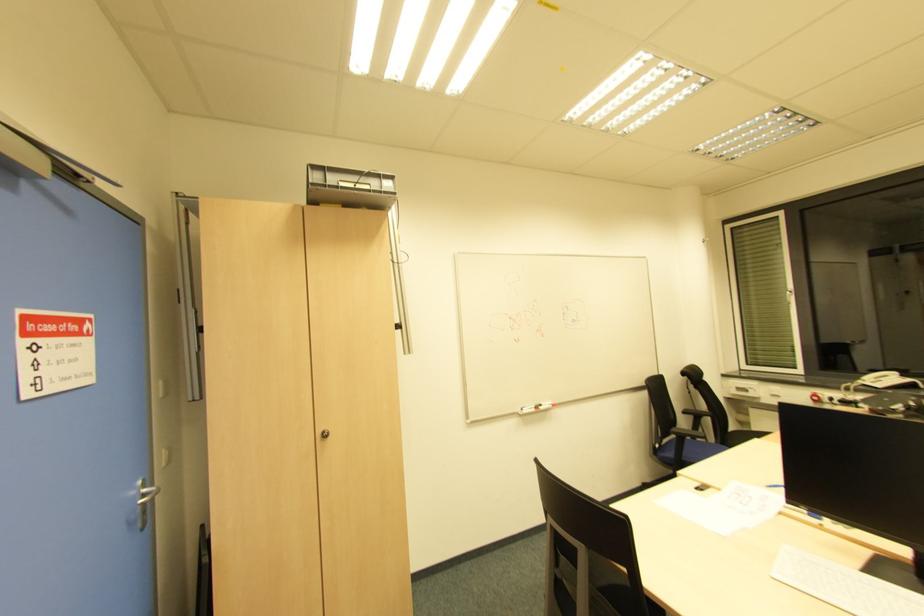
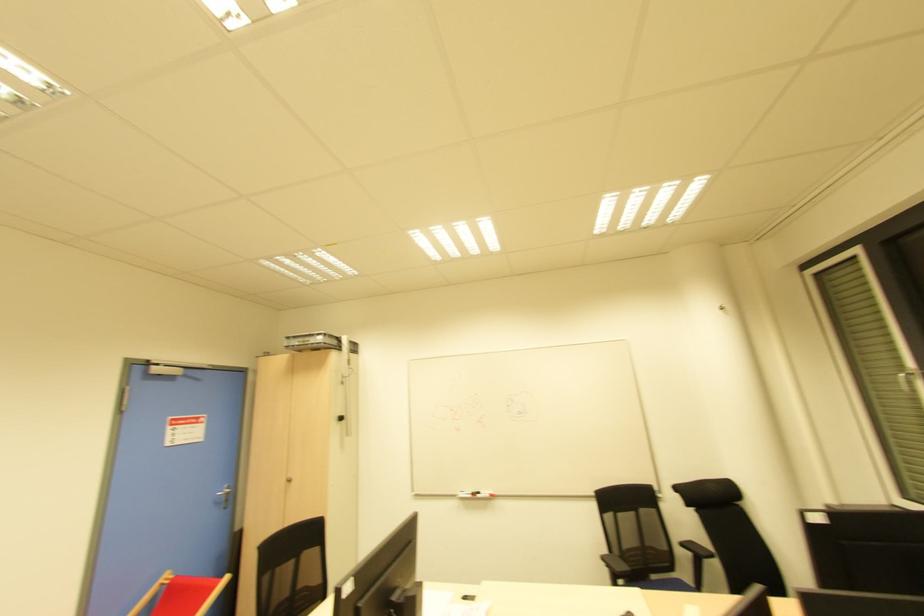
Find the pixel in the second image that matches the point at 312,187 in the first image.

(286, 347)